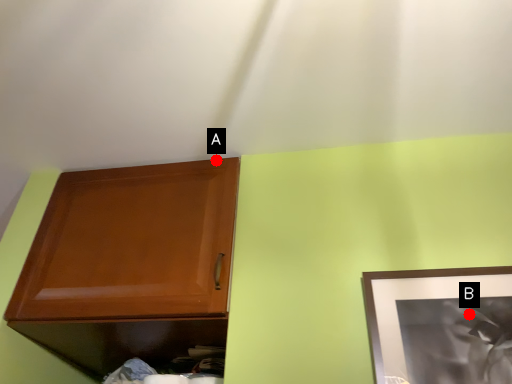
Question: Two points are circled on the image, labeled by A and B beside each circle. Which point is further to the camera?

Choices:
 (A) A is further
 (B) B is further

Answer: (A)